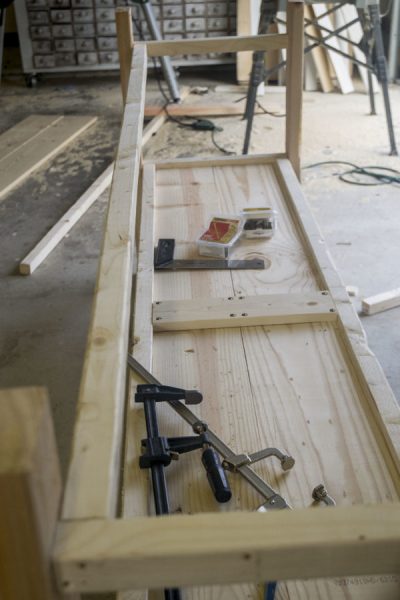
The image size is (400, 600). Identify the location of sawdust on the floor. (332, 126), (234, 131), (99, 108).